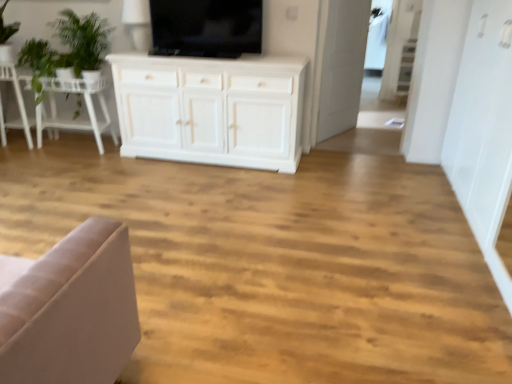
Question: Does green fabric chair at left come behind transparent glass door at upper right?

Choices:
 (A) no
 (B) yes

Answer: (A)

Question: Considering the relative positions of green fabric chair at left and transparent glass door at upper right in the image provided, is green fabric chair at left in front of transparent glass door at upper right?

Choices:
 (A) yes
 (B) no

Answer: (A)

Question: Considering the relative sizes of green fabric chair at left and transparent glass door at upper right in the image provided, is green fabric chair at left shorter than transparent glass door at upper right?

Choices:
 (A) yes
 (B) no

Answer: (A)

Question: Is green fabric chair at left wider than transparent glass door at upper right?

Choices:
 (A) yes
 (B) no

Answer: (A)

Question: Can you confirm if green fabric chair at left is positioned to the left of transparent glass door at upper right?

Choices:
 (A) yes
 (B) no

Answer: (A)

Question: Is transparent glass door at upper right located within green fabric chair at left?

Choices:
 (A) yes
 (B) no

Answer: (B)

Question: Can you confirm if transparent glass door at upper right is shorter than black glossy tv at upper center?

Choices:
 (A) no
 (B) yes

Answer: (A)

Question: Is the position of transparent glass door at upper right more distant than that of black glossy tv at upper center?

Choices:
 (A) no
 (B) yes

Answer: (B)

Question: Is transparent glass door at upper right not within black glossy tv at upper center?

Choices:
 (A) no
 (B) yes

Answer: (B)

Question: Would you say black glossy tv at upper center is part of transparent glass door at upper right's contents?

Choices:
 (A) yes
 (B) no

Answer: (B)

Question: Is transparent glass door at upper right aimed at black glossy tv at upper center?

Choices:
 (A) no
 (B) yes

Answer: (A)

Question: From the image's perspective, is transparent glass door at upper right above black glossy tv at upper center?

Choices:
 (A) yes
 (B) no

Answer: (A)

Question: Is green leafy plant at upper left facing towards black glossy tv at upper center?

Choices:
 (A) yes
 (B) no

Answer: (B)